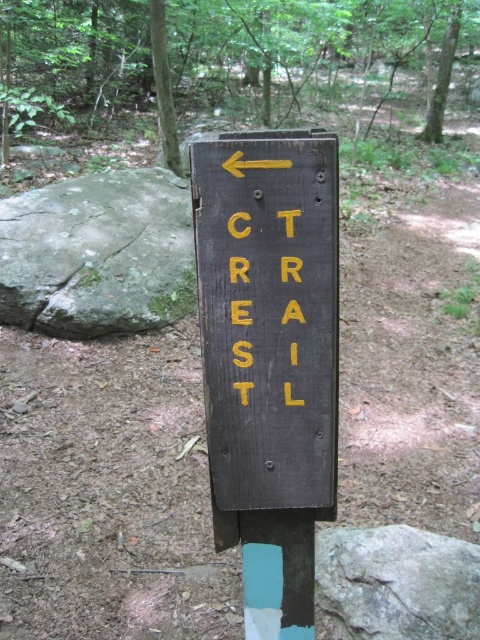
You are a hiker carrying a backpack and need to place a 3.5 meter long hiking pole between the green rough rock at left and the yellow painted letters at center. Can you fit the pole horizontally between them without bending it?

The distance between the green rough rock at left and the yellow painted letters at center is 3.39 meters. Since the pole is 3.5 meters long, it is slightly longer than the available space, so you cannot fit it horizontally without bending it.

You are a hiker who wants to place a small flag between the green rough rock at left and the gray rough rock at center. Based on their positions, which rock should the flag be closer to?

The green rough rock at left is positioned on the left side of the gray rough rock at center, so the flag should be placed closer to the gray rough rock at center.

You are a hiker trying to determine the best spot to place a 1.2 meter wide tent. You notice the green rough rock at left and the yellow painted letters at center. Which object is wider and could potentially block the tent placement?

The green rough rock at left might be wider than yellow painted letters at center, so it could potentially block the tent placement.